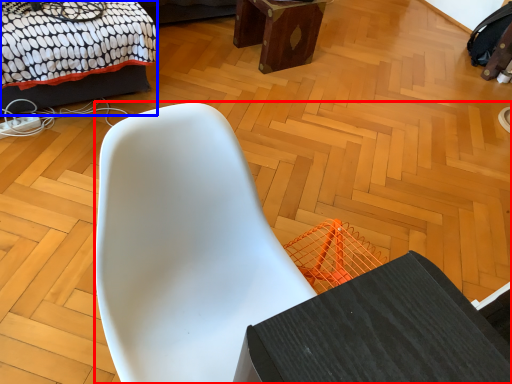
Question: Among these objects, which one is farthest to the camera, chair (highlighted by a red box) or bed (highlighted by a blue box)?

Choices:
 (A) chair
 (B) bed

Answer: (B)